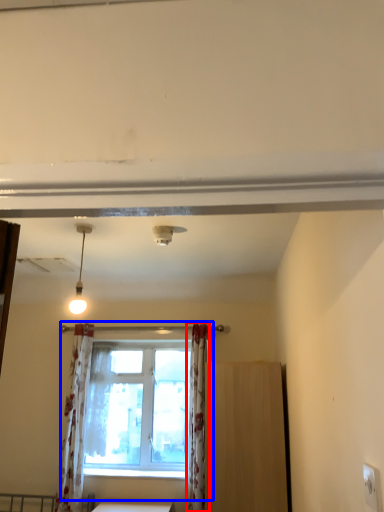
Question: Which of the following is the closest to the observer, curtain (highlighted by a red box) or window (highlighted by a blue box)?

Choices:
 (A) curtain
 (B) window

Answer: (A)